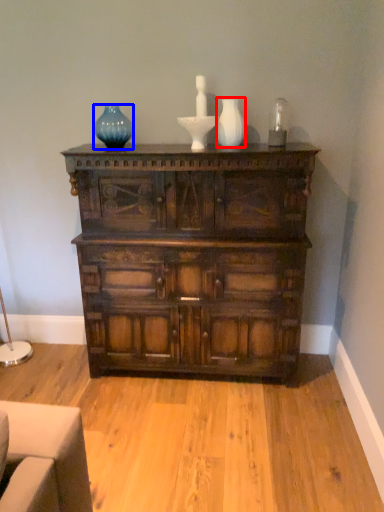
Question: Which object appears closest to the camera in this image, vase (highlighted by a red box) or glass vase (highlighted by a blue box)?

Choices:
 (A) vase
 (B) glass vase

Answer: (A)